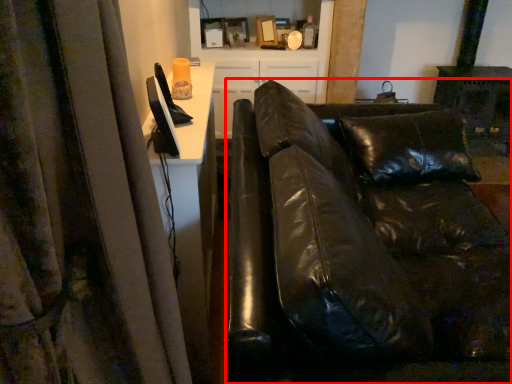
Question: From the image's perspective, what is the correct spatial relationship of studio couch (annotated by the red box) in relation to entertainment center?

Choices:
 (A) below
 (B) above

Answer: (A)